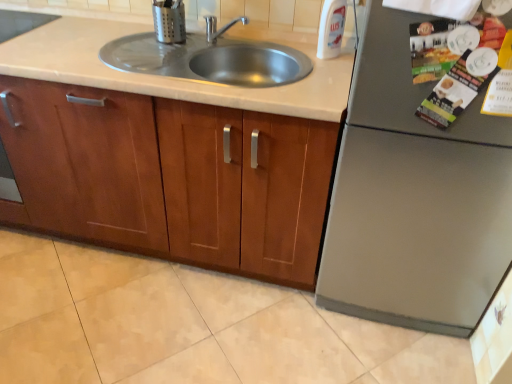
You are a GUI agent. You are given a task and a screenshot of the screen. Output one action in this format:
    pyautogui.click(x=<x>, y=<y>)
    Task: Click on the vacant area that lies in front of brushed metal utensil holder at upper center, the 2th appliance when ordered from front to back
    The image size is (512, 384).
    Given the screenshot: What is the action you would take?
    pyautogui.click(x=165, y=51)